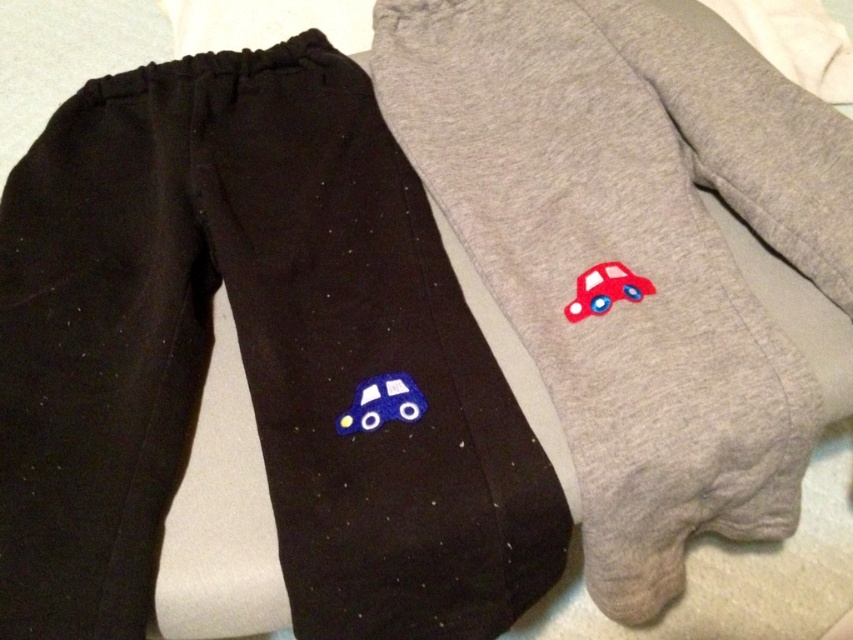
Is felt blue car at lower left to the right of matte fabric car at right from the viewer's perspective?

Incorrect, felt blue car at lower left is not on the right side of matte fabric car at right.

From the picture: Is felt blue car at lower left further to the viewer compared to matte fabric car at right?

That is False.

What do you see at coordinates (381, 403) in the screenshot?
I see `felt blue car at lower left` at bounding box center [381, 403].

Locate an element on the screen. The image size is (853, 640). felt blue car at lower left is located at coordinates (381, 403).

Which is above, matte black pants at left or gray cotton pants at center?

gray cotton pants at center is higher up.

Does matte black pants at left appear on the right side of gray cotton pants at center?

No, matte black pants at left is not to the right of gray cotton pants at center.

Does point (328, 538) lie behind point (654, 458)?

No, it is not.

Locate an element on the screen. matte black pants at left is located at coordinates tap(251, 356).

Can you confirm if matte black pants at left is wider than felt blue car at lower left?

Yes, matte black pants at left is wider than felt blue car at lower left.

This screenshot has height=640, width=853. Describe the element at coordinates (251, 356) in the screenshot. I see `matte black pants at left` at that location.

Which is in front, point (44, 552) or point (389, 403)?

Point (44, 552)

Find the location of a particular element. matte black pants at left is located at coordinates (251, 356).